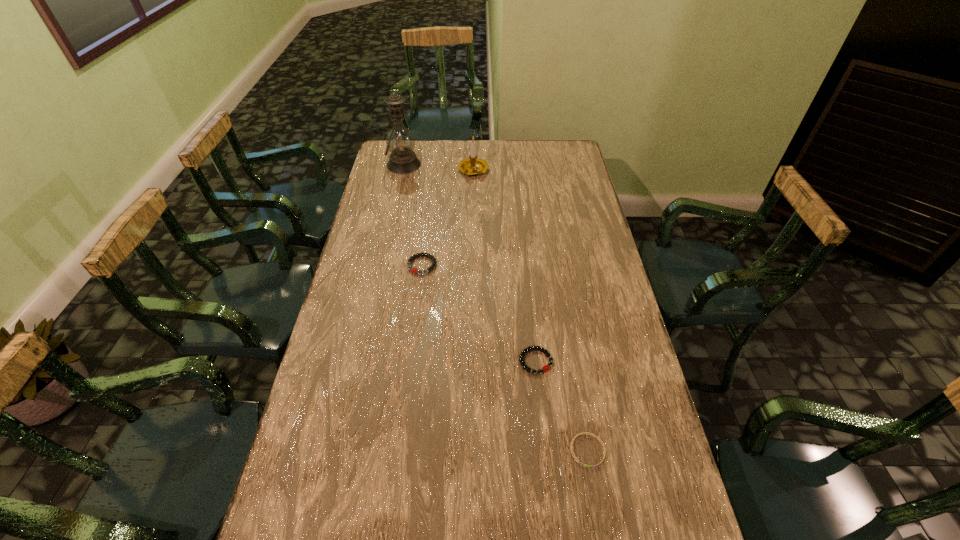
The width and height of the screenshot is (960, 540). I want to click on free point at the far edge, so click(x=530, y=154).

This screenshot has width=960, height=540. Identify the location of vacant space at the left edge. (372, 220).

Where is `free space at the right edge of the desktop`? The image size is (960, 540). free space at the right edge of the desktop is located at coordinates (601, 233).

I want to click on vacant area at the far right corner of the desktop, so click(565, 140).

The image size is (960, 540). Identify the location of free area in between the oil lamp and the leftmost bracelet. (413, 215).

Identify the location of empty space that is in between the farthest bracelet and the second object from right to left. (479, 313).

At what (x,y) coordinates should I click in order to perform the action: click on unoccupied area between the second object from left to right and the fourth shortest object. Please return your answer as a coordinate pair (x, y). This screenshot has height=540, width=960. Looking at the image, I should click on (447, 218).

Where is `vacant space that's between the nearest bracelet and the tallest object`? The image size is (960, 540). vacant space that's between the nearest bracelet and the tallest object is located at coordinates (495, 307).

I want to click on vacant area that lies between the leftmost object and the farthest bracelet, so point(413,215).

I want to click on vacant space that's between the farthest bracelet and the tallest object, so click(413, 215).